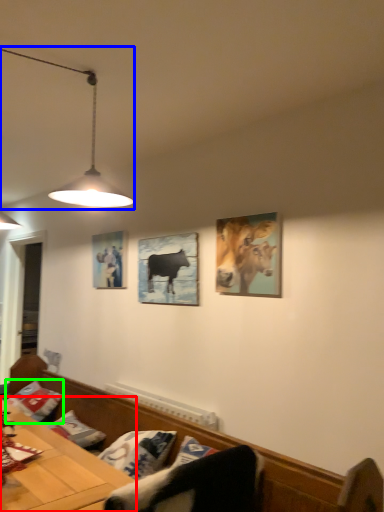
Question: Which object is the farthest from table (highlighted by a red box)? Choose among these: lamp (highlighted by a blue box) or pillow (highlighted by a green box).

Choices:
 (A) lamp
 (B) pillow

Answer: (A)